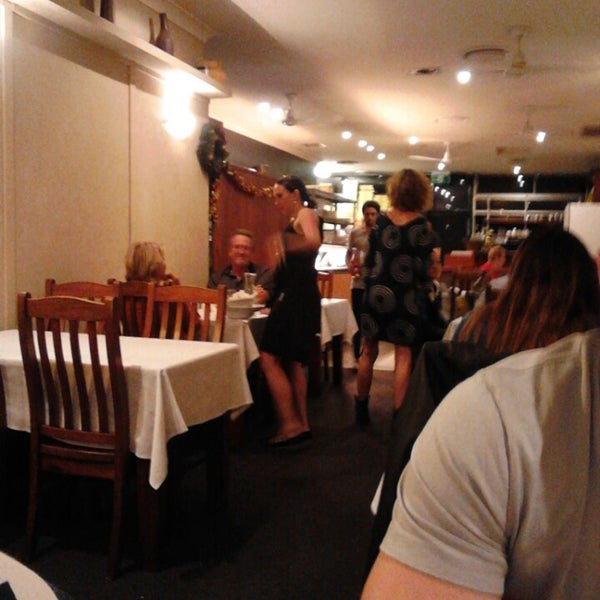
Image resolution: width=600 pixels, height=600 pixels. What are the coordinates of `tablecloth` in the screenshot? It's located at (330, 316), (178, 393).